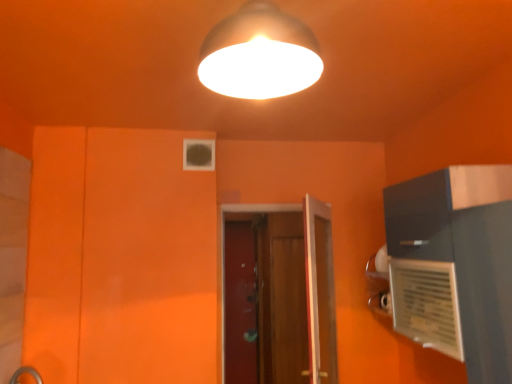
Question: From a real-world perspective, is wooden screen door at center, which appears as the 2th screen door when viewed from the left, positioned above or below wooden door at center?

Choices:
 (A) below
 (B) above

Answer: (A)

Question: In terms of width, does wooden screen door at center, which appears as the 2th screen door when viewed from the left, look wider or thinner when compared to wooden door at center?

Choices:
 (A) wide
 (B) thin

Answer: (A)

Question: Which of these objects is positioned farthest from the matte white lampshade at upper center?

Choices:
 (A) wooden screen door at center, which is the first screen door in right-to-left order
 (B) transparent glass screen door at center, which is the 1th screen door in left-to-right order
 (C) wooden door at center

Answer: (B)

Question: Estimate the real-world distances between objects in this image. Which object is farther from the wooden screen door at center, which appears as the 2th screen door when viewed from the left?

Choices:
 (A) transparent glass screen door at center, which is the 1th screen door in left-to-right order
 (B) matte white lampshade at upper center
 (C) wooden door at center

Answer: (B)